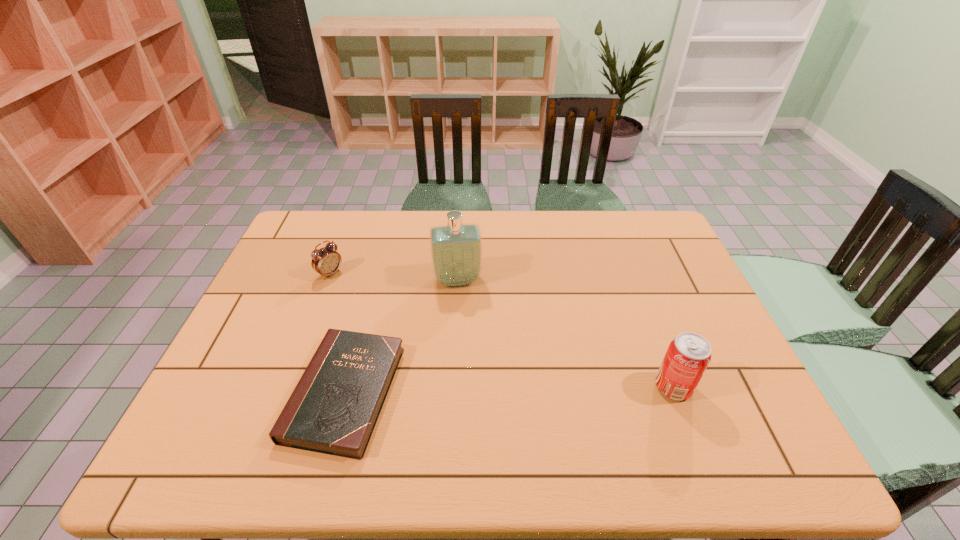
The height and width of the screenshot is (540, 960). In order to click on free space at the near edge of the desktop in this screenshot , I will do `click(505, 408)`.

In order to click on free region at the right edge in this screenshot , I will do `click(676, 267)`.

Identify the location of vacant space at the far left corner. (310, 222).

At what (x,y) coordinates should I click in order to perform the action: click on free region at the far right corner of the desktop. Please return your answer as a coordinate pair (x, y). This screenshot has width=960, height=540. Looking at the image, I should click on (627, 229).

The image size is (960, 540). In the image, there is a desktop. Find the location of `free space at the near right corner`. free space at the near right corner is located at coordinates (728, 395).

Locate an element on the screen. Image resolution: width=960 pixels, height=540 pixels. vacant area that lies between the shortest object and the third object from left to right is located at coordinates (401, 336).

Find the location of a particular element. vacant space that's between the Bible and the third shortest object is located at coordinates (509, 390).

In order to click on unoccupied position between the rightmost object and the shortest object in this screenshot , I will do `click(509, 390)`.

Where is `empty space between the second shortest object and the second tallest object`? empty space between the second shortest object and the second tallest object is located at coordinates (502, 330).

The image size is (960, 540). Identify the location of blank region between the second object from right to left and the Bible. (401, 336).